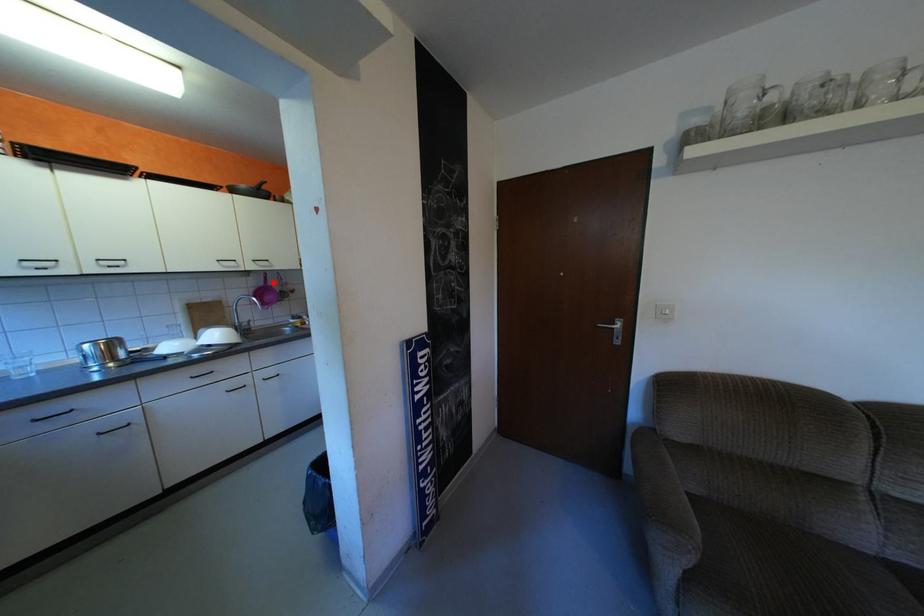
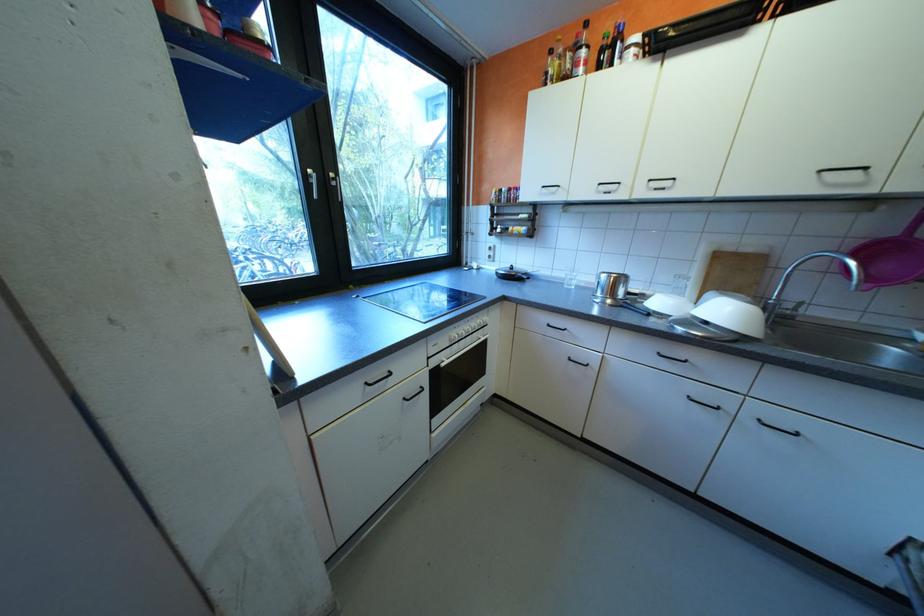
Question: I am providing you with two images of the same scene from different viewpoints. In image1, a red point is highlighted. Considering the same 3D point in image2, which of the following is correct?

Choices:
 (A) It is closer
 (B) It is farther

Answer: (B)